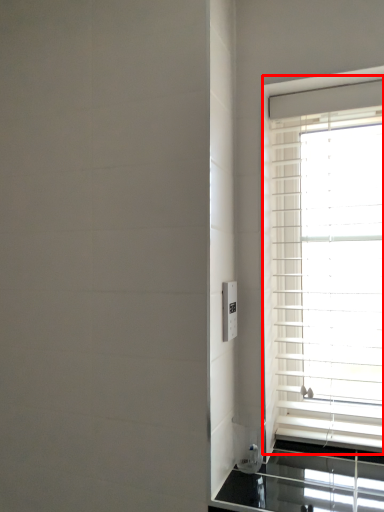
Question: Where is window (annotated by the red box) located in relation to electric outlet in the image?

Choices:
 (A) left
 (B) right

Answer: (B)